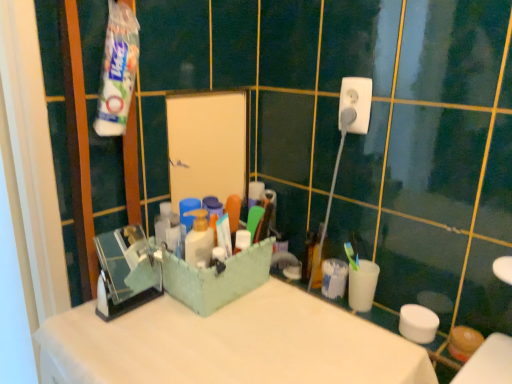
The height and width of the screenshot is (384, 512). I want to click on free location above white matte counter top at center (from a real-world perspective), so click(219, 333).